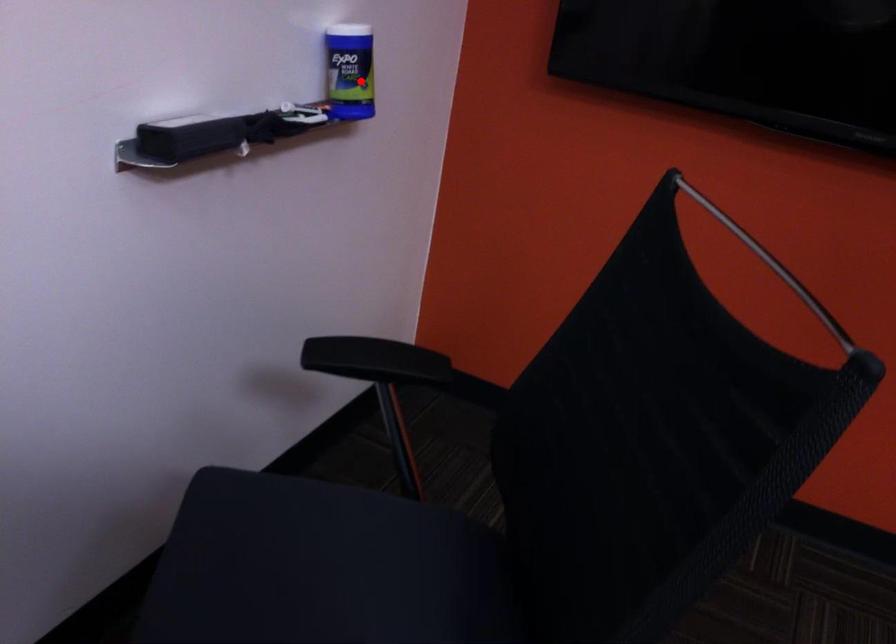
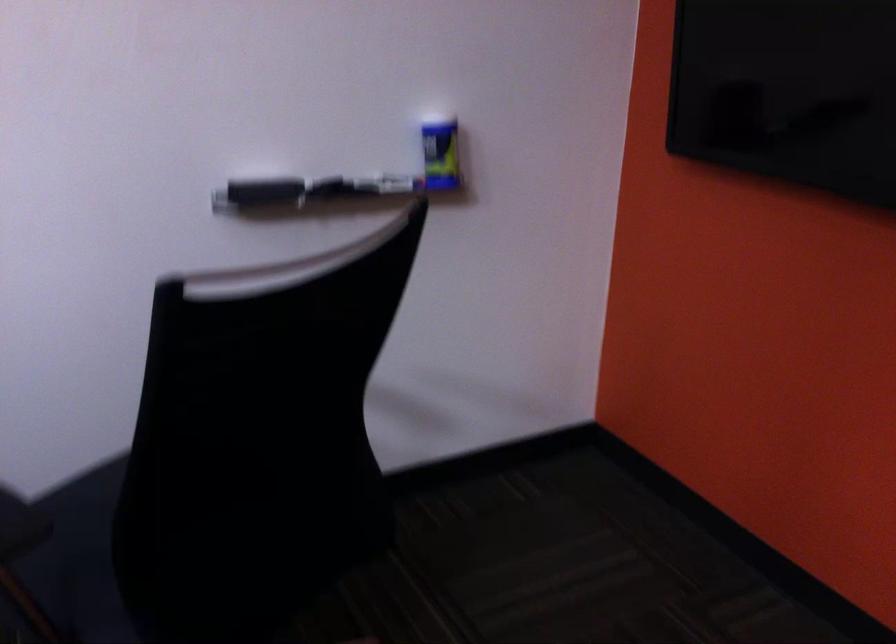
Question: I am providing you with two images of the same scene from different viewpoints. In image1, a red point is highlighted. Considering the same 3D point in image2, which of the following is correct?

Choices:
 (A) It is closer
 (B) It is farther

Answer: (B)